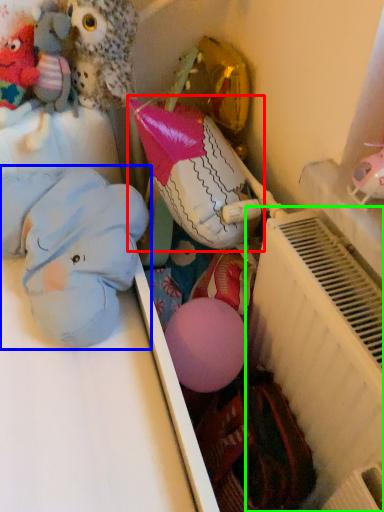
Question: Which object is positioned farthest from toy (highlighted by a red box)? Select from toy (highlighted by a blue box) and radiator (highlighted by a green box).

Choices:
 (A) toy
 (B) radiator

Answer: (B)